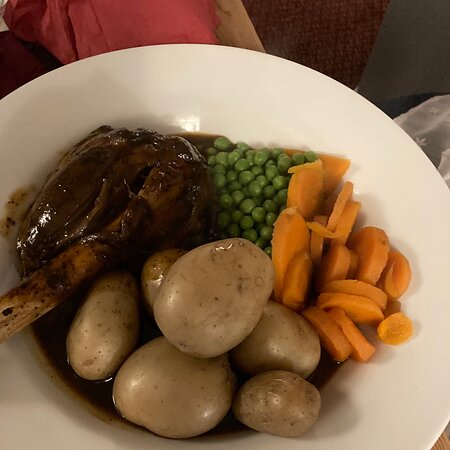
In order to click on napkin in this screenshot , I will do `click(423, 113)`.